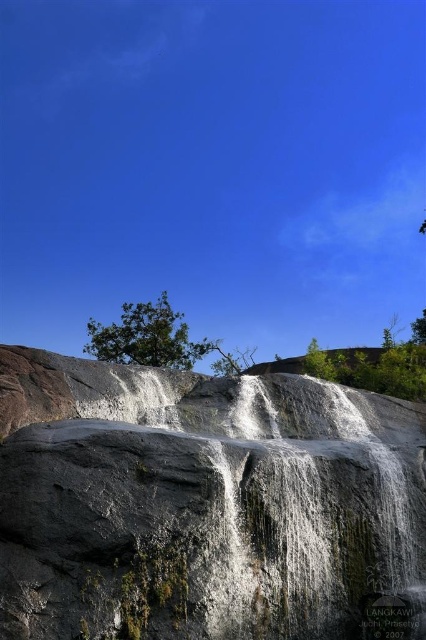
You are a geologist examining the image of the waterfall. You need to locate the gray rough rock face at center. Where is it positioned in the image?

The gray rough rock face at center is located at point (204, 504) in the image.

You are standing at the base of the waterfall and want to climb up to the green leafy tree at center. Which direction should you go relative to the gray rough rock face at center?

The gray rough rock face at center is below the green leafy tree at center, so you should climb upwards towards the green leafy tree at center above the gray rough rock face at center.